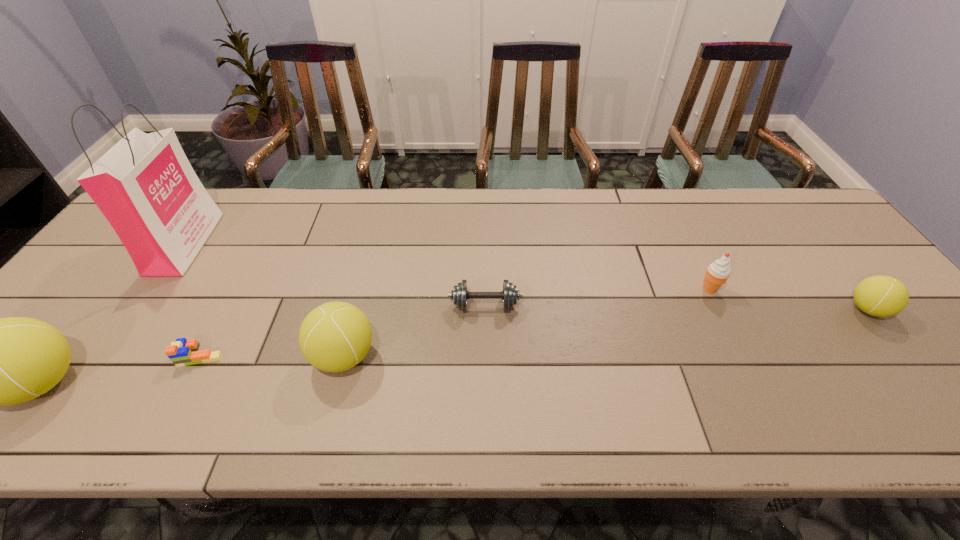
Please mark a free spot for a new tennis_ball to balance the arrangement. Please provide its 2D coordinates. Your answer should be formatted as a tuple, i.e. [(x, y)], where the tuple contains the x and y coordinates of a point satisfying the conditions above.

[(618, 332)]